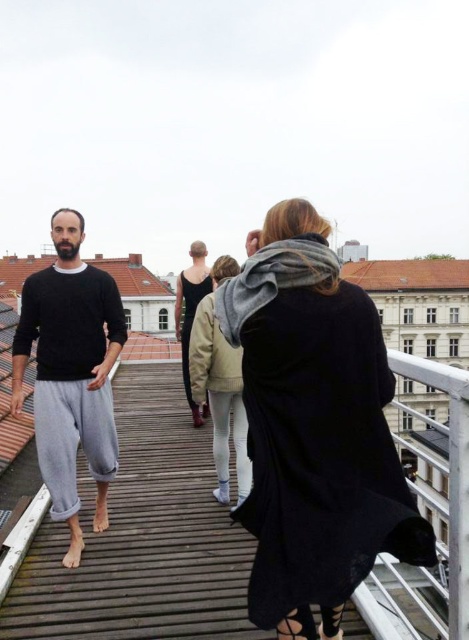
You are standing on the wooden platform and want to reach the point at coordinates point (380,536). Given that the platform is 40 meters long, can you safely walk to that point without exceeding the platform length?

The point (380,536) is 38.25 meters from the viewer, which is within the 40 meter length of the platform. Therefore, you can safely walk to that point without exceeding the platform length.

Looking at this image, you are a photographer positioned at the camera location. You want to capture a closeup shot of the black wool coat at center. Considering the distance, will you need a telephoto lens?

The black wool coat at center is 116.70 feet away from the camera. To capture a closeup shot from that distance, you would need a telephoto lens.

Based on the photo, you are standing at point (x=133, y=268) and want to walk to point (x=443, y=284). Is the destination point in front of or behind you?

The destination point (x=443, y=284) is in front of you because it is located in front of your current position at point (x=133, y=268).